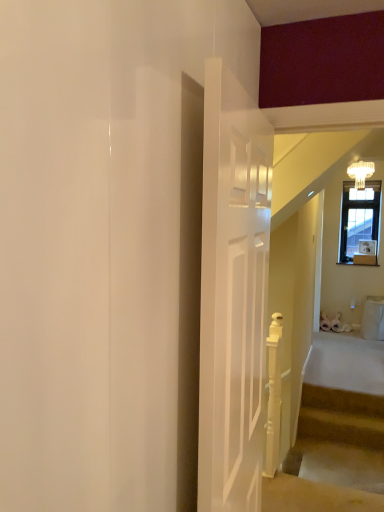
Find the location of `empty space that is ontop of carpeted stairs at lower right (from a real-world perspective)`. empty space that is ontop of carpeted stairs at lower right (from a real-world perspective) is located at coordinates (343, 415).